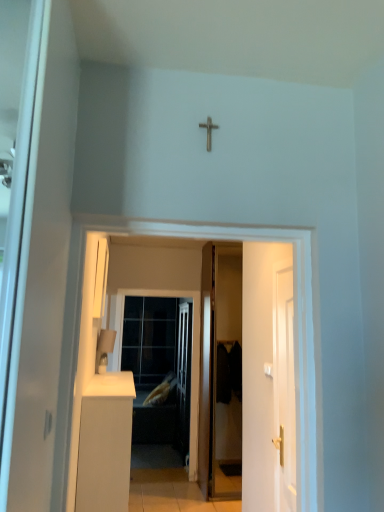
The image size is (384, 512). What do you see at coordinates (161, 391) in the screenshot? I see `soft yellow fabric pillow at center` at bounding box center [161, 391].

Identify the location of matte white lampshade at lower left. Image resolution: width=384 pixels, height=512 pixels. (105, 348).

Locate an element on the screen. transparent glass door at center is located at coordinates (149, 339).

Locate an element on the screen. soft yellow fabric pillow at center is located at coordinates (161, 391).

Which is in front, point (174, 289) or point (159, 393)?

The point (174, 289) is closer.

From a real-world perspective, relative to soft yellow fabric pillow at center, is clear glass screen door at center vertically above or below?

In terms of real-world spatial position, clear glass screen door at center is above soft yellow fabric pillow at center.

From the image's perspective, would you say clear glass screen door at center is shown under soft yellow fabric pillow at center?

No, from the image's perspective, clear glass screen door at center is not below soft yellow fabric pillow at center.

Based on the photo, considering the relative sizes of clear glass screen door at center and soft yellow fabric pillow at center in the image provided, is clear glass screen door at center thinner than soft yellow fabric pillow at center?

Yes.

Is point (136, 357) behind point (275, 282)?

Yes, point (136, 357) is farther from viewer.

Is transparent glass door at center taller than white glossy door at right, which ranks as the first door in right-to-left order?

Yes, transparent glass door at center is taller than white glossy door at right, which ranks as the first door in right-to-left order.

Based on the photo, which object is closer to the camera, transparent glass door at center or white glossy door at right, arranged as the second door when viewed from the left?

white glossy door at right, arranged as the second door when viewed from the left, is more forward.

From the image's perspective, between clear glass screen door at center and metallic cross at upper center, which one is located above?

metallic cross at upper center, from the image's perspective.

Locate an element on the screen. The height and width of the screenshot is (512, 384). crucifix on the right of clear glass screen door at center is located at coordinates (208, 130).

From the picture: How far apart are clear glass screen door at center and metallic cross at upper center?

clear glass screen door at center is 12.12 feet away from metallic cross at upper center.

Which object is closer to the camera taking this photo, clear glass screen door at center or metallic cross at upper center?

metallic cross at upper center is closer to the camera.

How distant is white matte cabinet at lower left from matte white lampshade at lower left?

19.54 inches.

Is white matte cabinet at lower left thinner than matte white lampshade at lower left?

No, white matte cabinet at lower left is not thinner than matte white lampshade at lower left.

From a real-world perspective, is white matte cabinet at lower left under matte white lampshade at lower left?

Yes, from a real-world perspective, white matte cabinet at lower left is beneath matte white lampshade at lower left.

Considering the sizes of objects metallic cross at upper center and clear glass screen door at center in the image provided, who is bigger, metallic cross at upper center or clear glass screen door at center?

With larger size is clear glass screen door at center.

Is metallic cross at upper center far away from clear glass screen door at center?

Yes.

Would you say metallic cross at upper center is inside or outside clear glass screen door at center?

metallic cross at upper center lies outside clear glass screen door at center.

Which is in front, point (88, 272) or point (156, 343)?

Point (88, 272)

From a real-world perspective, is white glossy door at center physically above transparent glass door at center?

Yes, from a real-world perspective, white glossy door at center is over transparent glass door at center

Which object is positioned more to the left, metallic cross at upper center or transparent glass door at center?

From the viewer's perspective, transparent glass door at center appears more on the left side.

Can transparent glass door at center be found inside metallic cross at upper center?

Actually, transparent glass door at center is outside metallic cross at upper center.

I want to click on glass door below the metallic cross at upper center (from the image's perspective), so coord(149,339).

From a real-world perspective, which object stands above the other?

metallic cross at upper center, from a real-world perspective.

The image size is (384, 512). What are the coordinates of `screen door that is above the soft yellow fabric pillow at center (from a real-world perspective)` in the screenshot? It's located at (192, 350).

From a real-world perspective, which door is the 1st one underneath the transparent glass door at center? Please provide its 2D coordinates.

[(284, 389)]

Looking at the image, which one is located closer to white glossy door at center, matte white lampshade at lower left or white glossy door at right, the first door in the front-to-back sequence?

Among the two, white glossy door at right, the first door in the front-to-back sequence, is located nearer to white glossy door at center.

Which object lies further to the anchor point white matte cabinet at lower left, white glossy door at center or transparent glass door at center?

The object further to white matte cabinet at lower left is transparent glass door at center.

Consider the image. When comparing their distances from wooden door at center, arranged as the first door when viewed from the left, does clear glass screen door at center or white glossy door at center seem further?

The object further to wooden door at center, arranged as the first door when viewed from the left, is white glossy door at center.

When comparing their distances from white glossy door at right, arranged as the second door when viewed from the left, does white matte cabinet at lower left or clear glass screen door at center seem further?

Among the two, clear glass screen door at center is located further to white glossy door at right, arranged as the second door when viewed from the left.

Looking at the image, which one is located further to clear glass screen door at center, transparent glass door at center or soft yellow fabric pillow at center?

soft yellow fabric pillow at center is positioned further to the anchor clear glass screen door at center.

Which object lies nearer to the anchor point metallic cross at upper center, clear glass screen door at center or matte white lampshade at lower left?

The object closer to metallic cross at upper center is matte white lampshade at lower left.

Which object lies further to the anchor point white glossy door at center, white glossy door at right, arranged as the second door when viewed from the left, or metallic cross at upper center?

white glossy door at right, arranged as the second door when viewed from the left, is further to white glossy door at center.

From the image, which object appears to be nearer to metallic cross at upper center, clear glass screen door at center or white matte cabinet at lower left?

white matte cabinet at lower left is positioned closer to the anchor metallic cross at upper center.

I want to click on screen door between metallic cross at upper center and soft yellow fabric pillow at center from front to back, so click(x=192, y=350).

At what (x,y) coordinates should I click in order to perform the action: click on screen door between matte white lampshade at lower left and soft yellow fabric pillow at center along the z-axis. Please return your answer as a coordinate pair (x, y). The width and height of the screenshot is (384, 512). Looking at the image, I should click on (192, 350).

This screenshot has width=384, height=512. In order to click on cabinetry between white glossy door at center and clear glass screen door at center along the z-axis in this screenshot , I will do `click(105, 443)`.

Where is `lamp located between metallic cross at upper center and soft yellow fabric pillow at center in the depth direction`? lamp located between metallic cross at upper center and soft yellow fabric pillow at center in the depth direction is located at coordinates (105, 348).